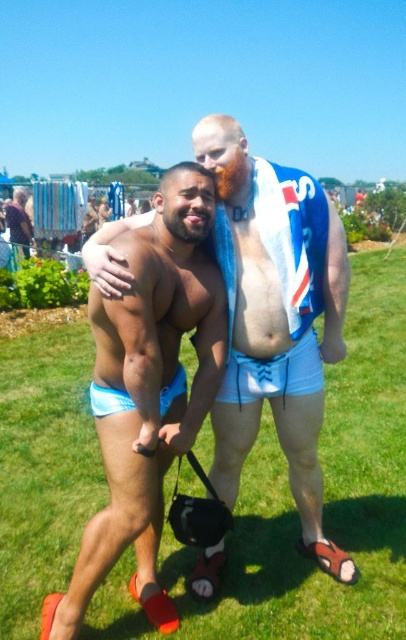
From the picture: You are trying to locate the blue fabric shorts at center and the blue fabric shorts at lower left in the image. Which of the two is positioned to the left?

The blue fabric shorts at center is positioned to the left of the blue fabric shorts at lower left.

You are standing at the origin point of the coordinate system. Where is the green grass at center located?

The green grass at center is located at point (x=295, y=508).

You are a photographer setting up a camera 20 feet away from the two people in the scene. You want to capture both the white fabric shorts at center and the blue fabric shorts at lower left in the same frame. Based on the distance between them, will they both fit within a standard camera frame that has a maximum horizontal field of view of 20 inches at that distance?

The distance between the white fabric shorts at center and the blue fabric shorts at lower left is 17.68 inches, which is less than the camera frame maximum horizontal field of view of 20 inches. Therefore, both will fit within the frame.